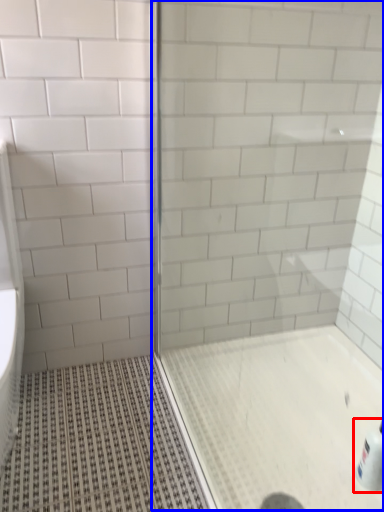
Question: Which object appears farthest to the camera in this image, bottle (highlighted by a red box) or screen door (highlighted by a blue box)?

Choices:
 (A) bottle
 (B) screen door

Answer: (A)